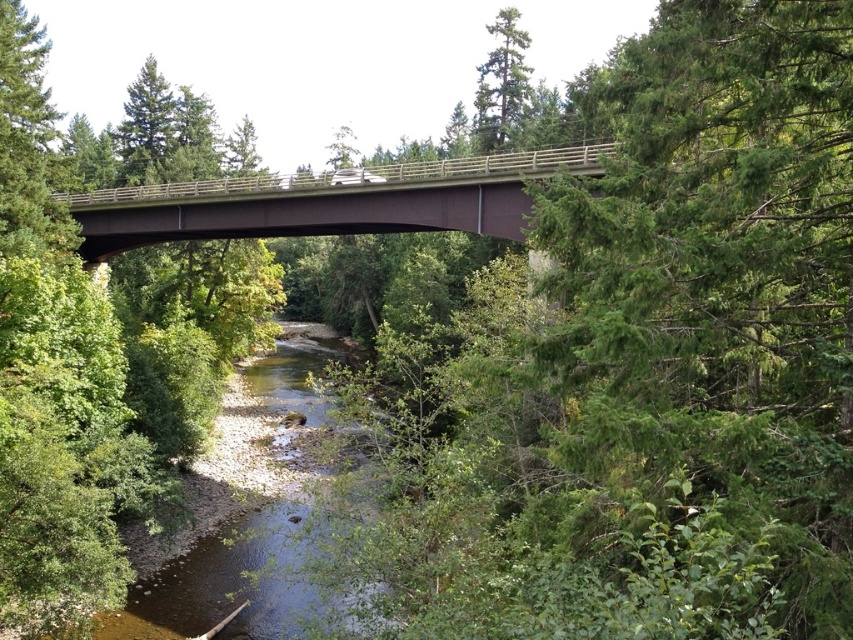
Does point (303, 220) lie in front of point (480, 88)?

Yes, point (303, 220) is in front of point (480, 88).

Is brown metallic bridge at center to the left of green matte tree at upper center from the viewer's perspective?

Correct, you'll find brown metallic bridge at center to the left of green matte tree at upper center.

Who is more distant from viewer, (521, 154) or (503, 12)?

Point (503, 12)

You are a GUI agent. You are given a task and a screenshot of the screen. Output one action in this format:
    pyautogui.click(x=<x>, y=<y>)
    Task: Click on the brown metallic bridge at center
    The image size is (853, 640).
    Given the screenshot: What is the action you would take?
    pyautogui.click(x=329, y=202)

What do you see at coordinates (241, 515) in the screenshot?
I see `clear water at center` at bounding box center [241, 515].

Is clear water at center further to camera compared to green matte tree at upper center?

No.

What do you see at coordinates (241, 515) in the screenshot? This screenshot has width=853, height=640. I see `clear water at center` at bounding box center [241, 515].

At what (x,y) coordinates should I click in order to perform the action: click on clear water at center. Please return your answer as a coordinate pair (x, y). The image size is (853, 640). Looking at the image, I should click on (241, 515).

Is clear water at center shorter than brown metallic bridge at center?

Indeed, clear water at center has a lesser height compared to brown metallic bridge at center.

Who is more forward, (218, 611) or (494, 214)?

Point (218, 611)

Locate an element on the screen. clear water at center is located at coordinates (241, 515).